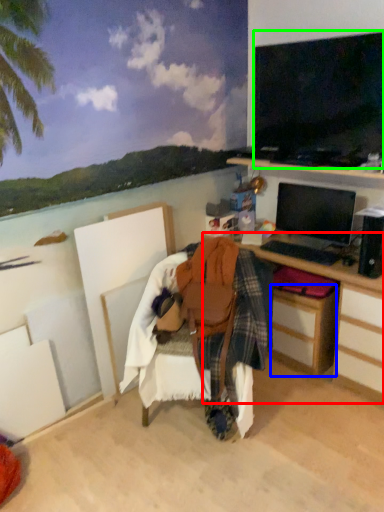
Question: Which object is positioned farthest from desk (highlighted by a red box)? Select from drawer (highlighted by a blue box) and television (highlighted by a green box).

Choices:
 (A) drawer
 (B) television

Answer: (B)